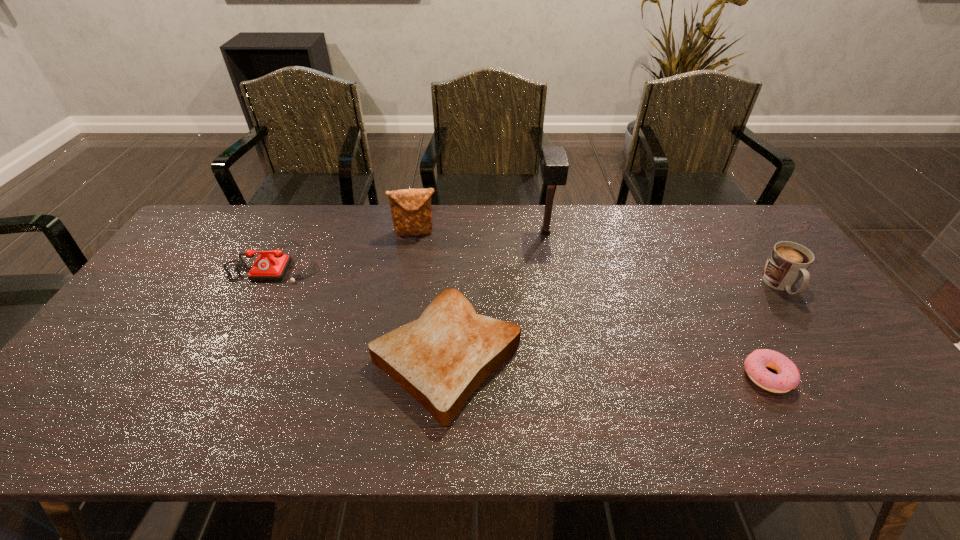
The width and height of the screenshot is (960, 540). I want to click on mallet, so click(554, 166).

What are the coordinates of `the third object from right to left` in the screenshot? It's located at (554, 166).

At what (x,y) coordinates should I click in order to perform the action: click on clutch bag. Please return your answer as a coordinate pair (x, y). The width and height of the screenshot is (960, 540). Looking at the image, I should click on (411, 211).

Locate an element on the screen. The height and width of the screenshot is (540, 960). the rightmost object is located at coordinates (788, 261).

Where is `mug`? mug is located at coordinates (788, 261).

The height and width of the screenshot is (540, 960). I want to click on the fourth tallest object, so click(273, 266).

You are a GUI agent. You are given a task and a screenshot of the screen. Output one action in this format:
    pyautogui.click(x=<x>, y=<y>)
    Task: Click on the telephone
    The image size is (960, 540).
    Given the screenshot: What is the action you would take?
    point(273,266)

Locate an element on the screen. This screenshot has height=540, width=960. bread is located at coordinates (440, 359).

This screenshot has height=540, width=960. In order to click on doughnut in this screenshot , I will do `click(788, 377)`.

Locate an element on the screen. The image size is (960, 540). the fifth object from left to right is located at coordinates (788, 377).